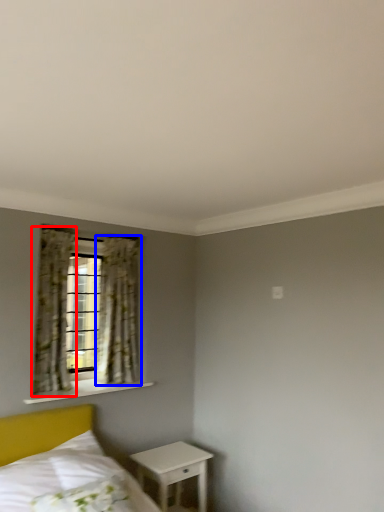
Question: Which object is closer to the camera taking this photo, curtain (highlighted by a red box) or curtain (highlighted by a blue box)?

Choices:
 (A) curtain
 (B) curtain

Answer: (A)